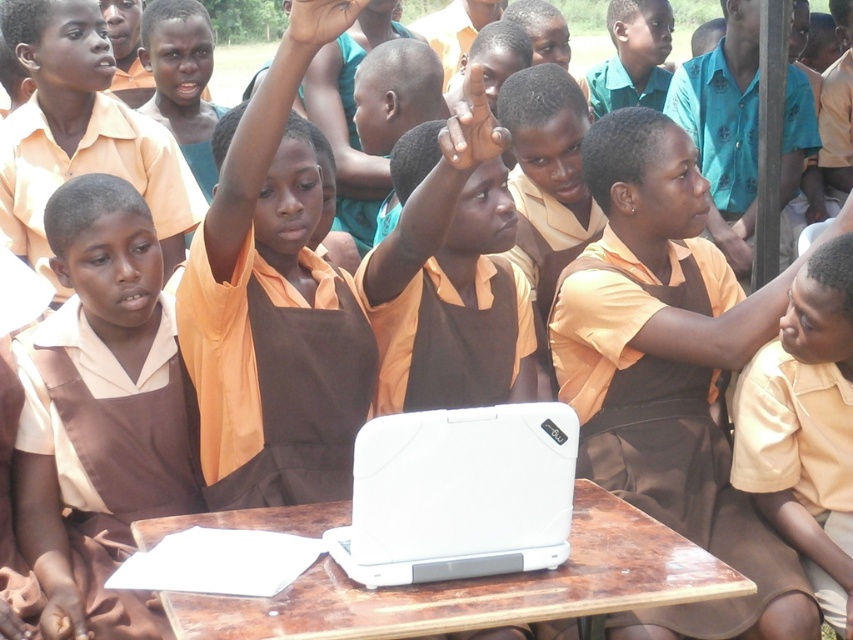
Based on the photo, you are a teacher standing in front of the classroom. You need to hand out a worksheet to the child wearing the brown matte uniform at center and the child with the white plastic laptop at center. If your reach is 1 meter, can you reach both students without moving?

The brown matte uniform at center and white plastic laptop at center are 1.04 meters apart. Since your reach is only 1 meter, you cannot reach both students at the same time without moving closer to them.

You are a teacher in the classroom and want to call on the student wearing the brown matte uniform at center and the orange matte shirt at upper center. Which student should you call first if you want to call the one closer to you?

The brown matte uniform at center is closer to the viewer than the orange matte shirt at upper center, so you should call the student wearing the brown matte uniform at center first.

You are a teacher observing the classroom scene. You notice the brown matte uniform at center and the orange matte shirt at upper center. Which of these two items is positioned higher up in the image?

The brown matte uniform at center is located above the orange matte shirt at upper center, so it is positioned higher up in the image.